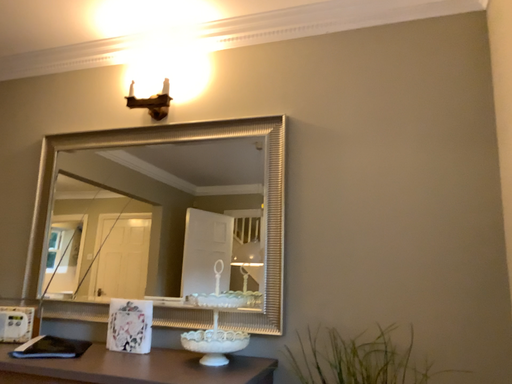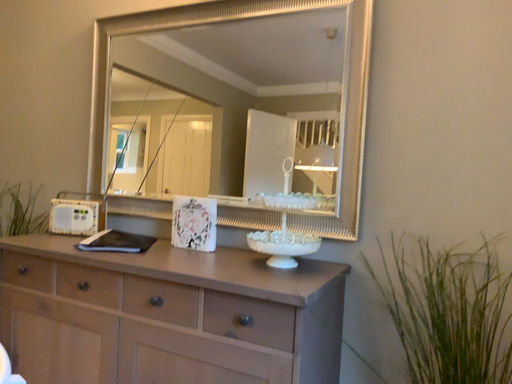
Question: Which way did the camera rotate in the video?

Choices:
 (A) rotated right
 (B) rotated left

Answer: (B)